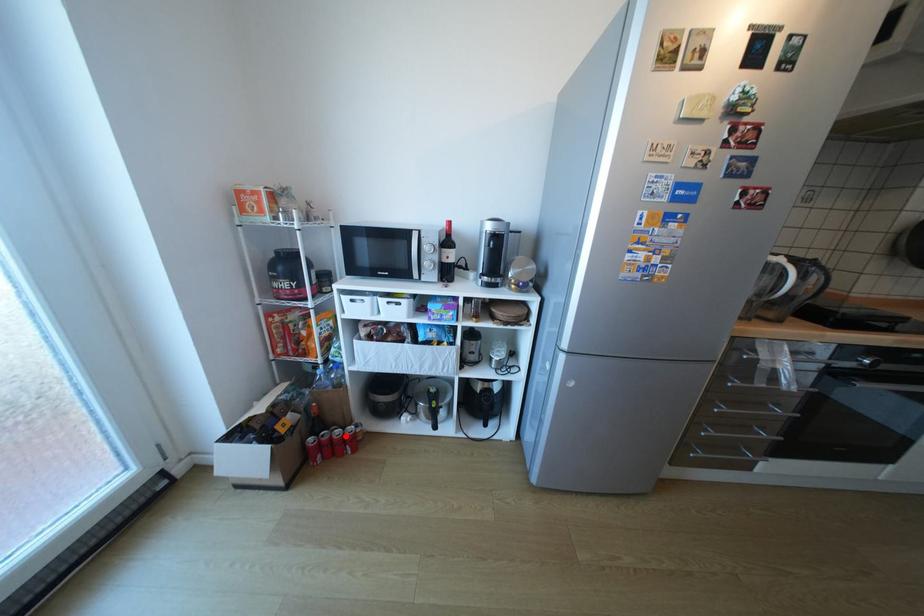
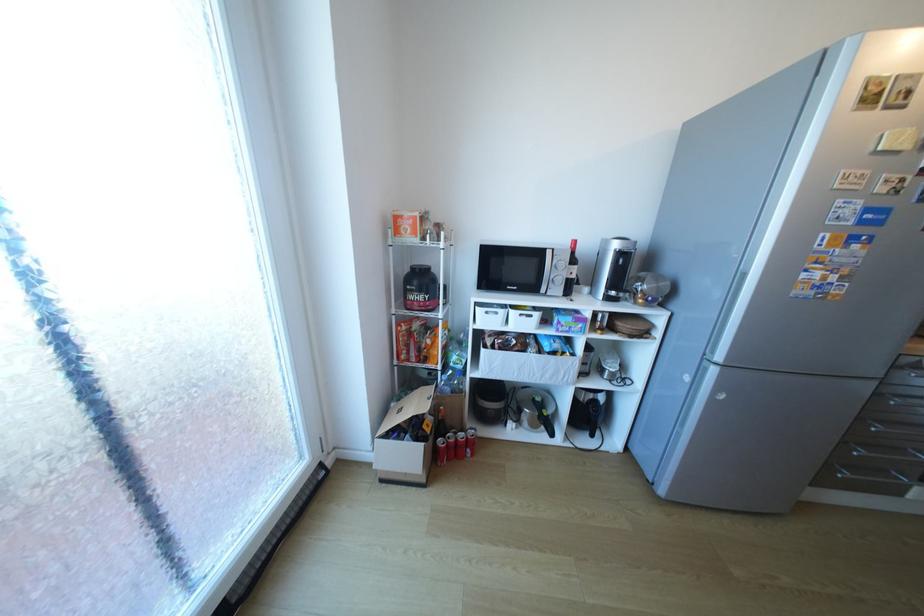
Question: A red point is marked in image1. In image2, is the corresponding 3D point closer to the camera or farther? Reply with the corresponding letter.

Choices:
 (A) The corresponding 3D point is closer.
 (B) The corresponding 3D point is farther.

Answer: (B)